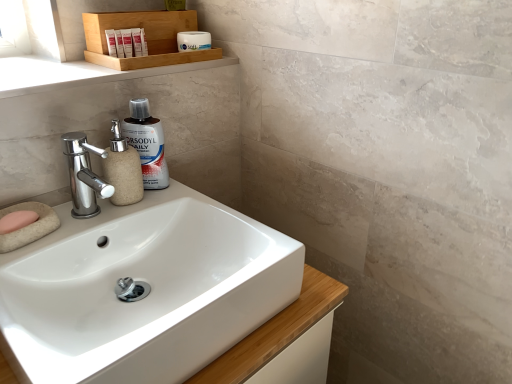
Question: Is white matte tube at upper center, placed as the second toiletry when sorted from front to back, to the right of matte white tube at upper left, acting as the 1th toiletry starting from the front, from the viewer's perspective?

Choices:
 (A) yes
 (B) no

Answer: (A)

Question: Does white matte tube at upper center, placed as the second toiletry when sorted from front to back, have a greater width compared to matte white tube at upper left, which is counted as the 3th toiletry, starting from the right?

Choices:
 (A) no
 (B) yes

Answer: (B)

Question: Considering the relative sizes of white matte tube at upper center, the second toiletry in the left-to-right sequence, and matte white tube at upper left, which is the first toiletry from left to right, in the image provided, is white matte tube at upper center, the second toiletry in the left-to-right sequence, taller than matte white tube at upper left, which is the first toiletry from left to right,?

Choices:
 (A) yes
 (B) no

Answer: (B)

Question: From the image's perspective, is white matte tube at upper center, the second toiletry in the left-to-right sequence, below matte white tube at upper left, marked as the third toiletry in a back-to-front arrangement?

Choices:
 (A) yes
 (B) no

Answer: (B)

Question: Are white matte tube at upper center, placed as the second toiletry when sorted from front to back, and matte white tube at upper left, acting as the 1th toiletry starting from the front, located far from each other?

Choices:
 (A) no
 (B) yes

Answer: (A)

Question: From the image's perspective, is white matte jar at upper center, which is the first toiletry in right-to-left order, located above or below chrome/metallic faucet at left?

Choices:
 (A) below
 (B) above

Answer: (B)

Question: In the image, is white matte jar at upper center, the 1th toiletry when ordered from back to front, on the left side or the right side of chrome/metallic faucet at left?

Choices:
 (A) left
 (B) right

Answer: (B)

Question: In terms of size, does white matte jar at upper center, the 1th toiletry when ordered from back to front, appear bigger or smaller than chrome/metallic faucet at left?

Choices:
 (A) small
 (B) big

Answer: (A)

Question: Is white matte jar at upper center, positioned as the third toiletry in left-to-right order, in front of or behind chrome/metallic faucet at left in the image?

Choices:
 (A) behind
 (B) front

Answer: (A)

Question: From the image's perspective, is wooden tray at upper center above or below pink sponge at lower left?

Choices:
 (A) above
 (B) below

Answer: (A)

Question: Considering the positions of point (x=167, y=31) and point (x=6, y=228), is point (x=167, y=31) closer or farther from the camera than point (x=6, y=228)?

Choices:
 (A) closer
 (B) farther

Answer: (B)

Question: Considering the positions of wooden tray at upper center and pink sponge at lower left in the image, is wooden tray at upper center bigger or smaller than pink sponge at lower left?

Choices:
 (A) small
 (B) big

Answer: (B)

Question: Would you say wooden tray at upper center is to the left or to the right of pink sponge at lower left in the picture?

Choices:
 (A) right
 (B) left

Answer: (A)

Question: Considering their positions, is wooden tray at upper center located in front of or behind chrome/metallic faucet at left?

Choices:
 (A) behind
 (B) front

Answer: (A)

Question: Is point (101, 26) closer or farther from the camera than point (64, 148)?

Choices:
 (A) closer
 (B) farther

Answer: (B)